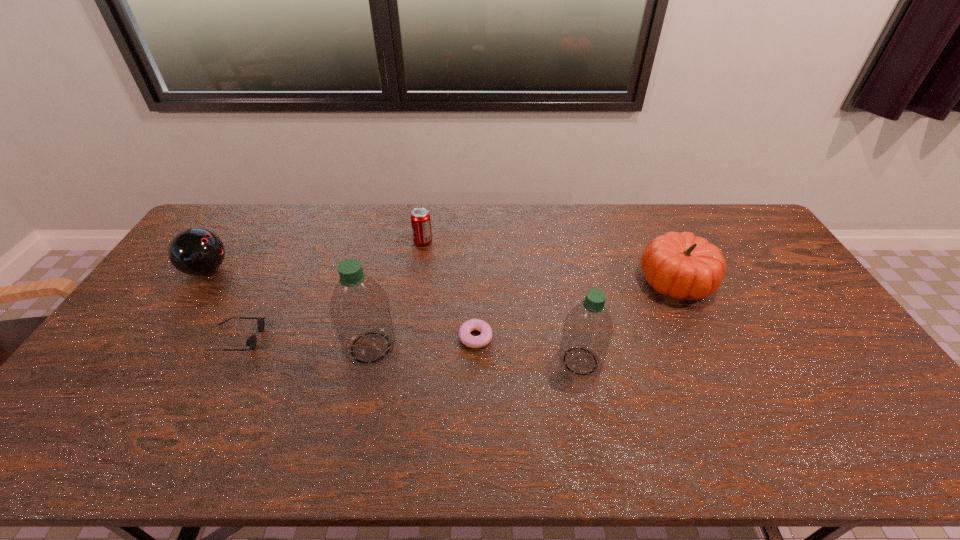
In order to click on the shortest object in this screenshot , I will do `click(485, 337)`.

Identify the location of the fifth object from left to right. The image size is (960, 540). (485, 337).

Locate an element on the screen. This screenshot has height=540, width=960. vacant area located on the front of the taller water bottle is located at coordinates (358, 403).

Find the location of a particular element. This screenshot has width=960, height=540. free location located 0.390m on the left of the shorter water bottle is located at coordinates (412, 361).

You are a GUI agent. You are given a task and a screenshot of the screen. Output one action in this format:
    pyautogui.click(x=<x>, y=<y>)
    Task: Click on the free space located 0.400m on the left of the soda can
    
    Given the screenshot: What is the action you would take?
    pyautogui.click(x=300, y=241)

Where is `free space located on the front-facing side of the second shortest object`? free space located on the front-facing side of the second shortest object is located at coordinates (368, 339).

I want to click on free space located 0.080m on the surface of the leftmost object near the finger holes, so pyautogui.click(x=255, y=270).

At what (x,y) coordinates should I click in order to perform the action: click on free region located on the front of the rightmost object. Please return your answer as a coordinate pair (x, y). The image size is (960, 540). Looking at the image, I should click on (713, 361).

Locate an element on the screen. The width and height of the screenshot is (960, 540). vacant region located 0.240m on the right of the fifth object from left to right is located at coordinates (577, 337).

In order to click on object that is at the far edge in this screenshot , I will do `click(420, 217)`.